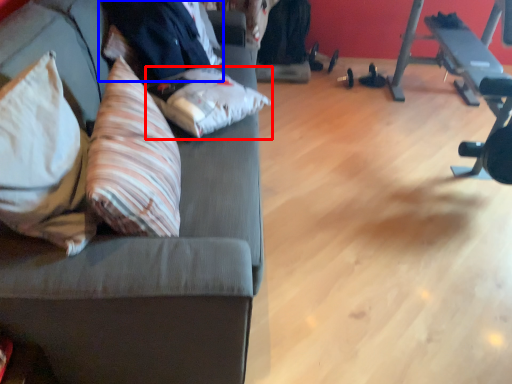
Question: Which point is closer to the camera, pillow (highlighted by a red box) or businessman (highlighted by a blue box)?

Choices:
 (A) pillow
 (B) businessman

Answer: (A)